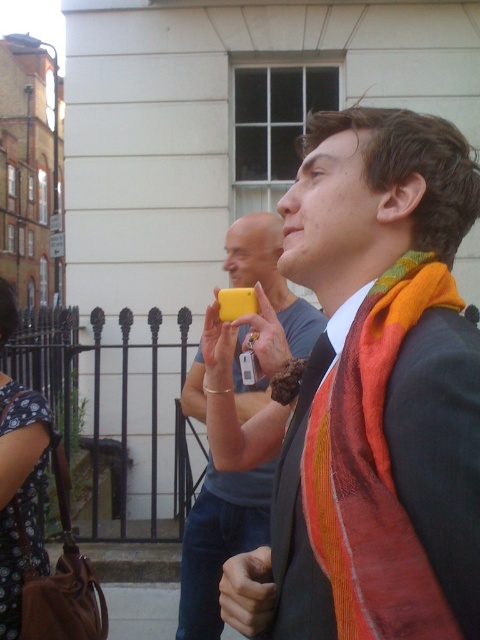
From the picture: You are standing in front of the white building with the black wrought iron fence. There are two points marked in the image. The first point is at coordinates point (309, 476) and the second point is at point (37, 392). Which of these two points is closer to you?

Point (309, 476) is closer to the camera than point (37, 392).

You are a photographer trying to capture a candid shot of the scene. You want to ensure that both the multicolored woven scarf at right and the dark floral dress at lower left are in focus. Given that your camera can only focus on objects within a 5 feet range of each other, will you be able to achieve this?

The distance between the multicolored woven scarf at right and the dark floral dress at lower left is 5.63 feet, which exceeds the camera focus range of 5 feet. Therefore, you cannot have both in focus simultaneously.

You are a delivery person standing at the dark floral dress at lower left position. You need to hand over a package to the person holding the matte orange scarf at right. What is the shortest distance you need to walk to reach them?

The shortest distance you need to walk is 1.53 meters to reach the matte orange scarf at right from the dark floral dress at lower left position.